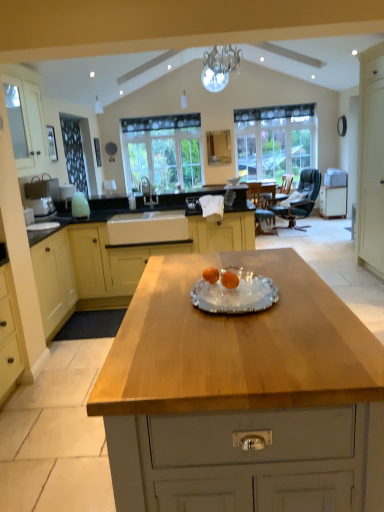
Locate an element on the screen. This screenshot has width=384, height=512. free location above wooden table at center (from a real-world perspective) is located at coordinates (188, 283).